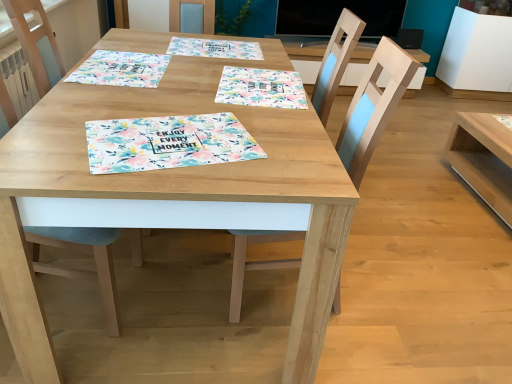
Question: From a real-world perspective, is wooden table at center, which is the 2th table in right-to-left order, above or below floral paper placemat at center?

Choices:
 (A) above
 (B) below

Answer: (B)

Question: Is wooden table at center, which is the 2th table in right-to-left order, in front of or behind floral paper placemat at center in the image?

Choices:
 (A) front
 (B) behind

Answer: (A)

Question: Which of these objects is positioned farthest from the light blue fabric chair at lower left, which appears as the first chair when viewed from the left?

Choices:
 (A) light wood table at right, placed as the first table when sorted from right to left
 (B) floral paper placemat at center, the third tablecloth when ordered from left to right
 (C) floral paper placemat at upper center, marked as the second tablecloth in a right-to-left arrangement
 (D) wooden table at center, which is the 2th table in right-to-left order
 (E) floral paper placemat at center

Answer: (A)

Question: Which is nearer to the wooden chair at center, the first chair when ordered from right to left?

Choices:
 (A) floral paper placemat at upper center, the second tablecloth in the left-to-right sequence
 (B) floral paper placemat at center
 (C) light blue fabric chair at lower left, the 2th chair from the right
 (D) wooden table at center, which is counted as the first table, starting from the left
 (E) floral paper placemat at upper left, which ranks as the 3th tablecloth in right-to-left order

Answer: (B)